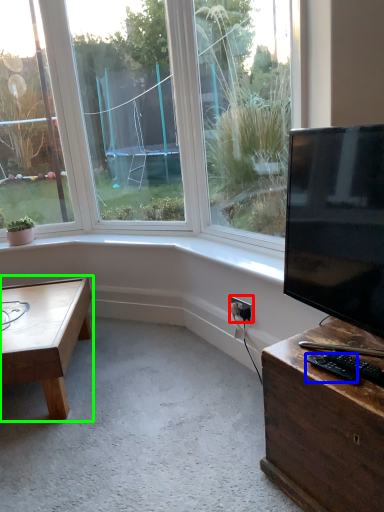
Question: Which object is positioned closest to electric outlet (highlighted by a red box)? Select from wide (highlighted by a blue box) and coffee table (highlighted by a green box).

Choices:
 (A) wide
 (B) coffee table

Answer: (A)